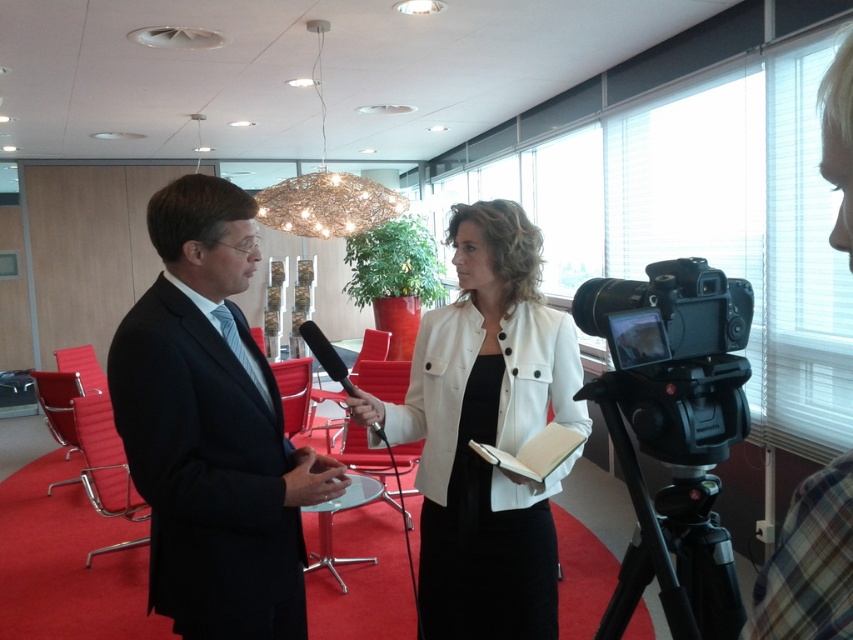
Is the position of black matte tripod at lower right less distant than that of black plastic video camera at right?

Answer: No, black matte tripod at lower right is further to the viewer.

Between point (720, 588) and point (598, 292), which one is positioned in front?

Positioned in front is point (720, 588).

Who is more distant from viewer, (633,387) or (691,337)?

Positioned behind is point (633,387).

Image resolution: width=853 pixels, height=640 pixels. Identify the location of black matte tripod at lower right. (676, 490).

Does dark blue suit at center appear on the left side of white matte jacket at upper center?

Indeed, dark blue suit at center is positioned on the left side of white matte jacket at upper center.

Which is more to the right, dark blue suit at center or white matte jacket at upper center?

white matte jacket at upper center

Where is `dark blue suit at center`? dark blue suit at center is located at coordinates (212, 428).

Who is shorter, white matte jacket at upper center or black matte microphone at center?

black matte microphone at center

Is white matte jacket at upper center to the right of black matte microphone at center from the viewer's perspective?

Correct, you'll find white matte jacket at upper center to the right of black matte microphone at center.

Is point (827, 600) positioned after point (335, 362)?

No, it is in front of (335, 362).

You are a GUI agent. You are given a task and a screenshot of the screen. Output one action in this format:
    pyautogui.click(x=<x>, y=<y>)
    Task: Click on the white matte jacket at upper center
    
    Given the screenshot: What is the action you would take?
    809,563